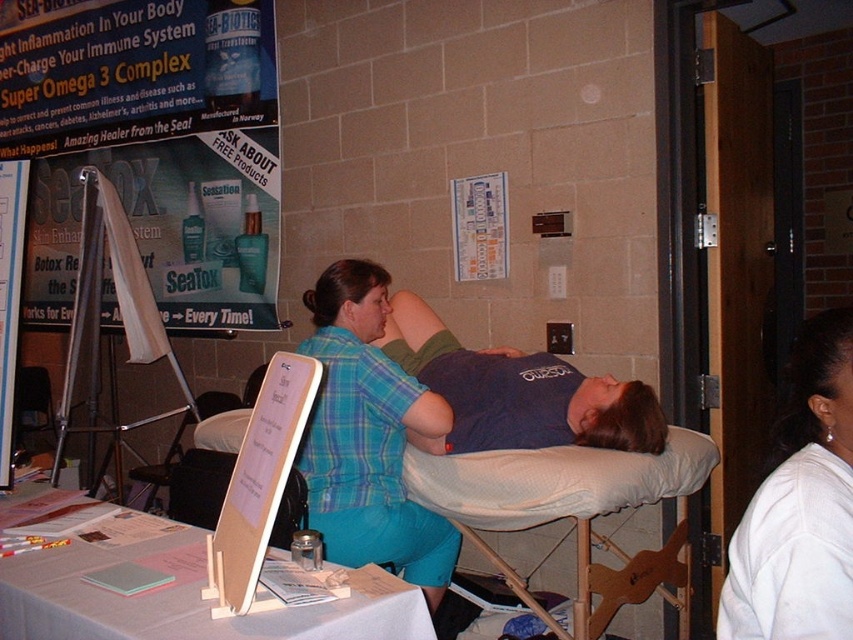
Question: Estimate the real-world distances between objects in this image. Which object is closer to the blue cotton shirt at center?

Choices:
 (A) black plastic chair at lower left
 (B) matte plastic poster at upper left
 (C) white fabric at upper right

Answer: (C)

Question: Is white fabric at upper right smaller than white paper at center?

Choices:
 (A) yes
 (B) no

Answer: (A)

Question: Can you confirm if matte plastic poster at upper left is smaller than white fabric at upper right?

Choices:
 (A) no
 (B) yes

Answer: (A)

Question: Which of the following is the closest to the observer?

Choices:
 (A) matte plastic poster at upper left
 (B) black plastic chair at lower left

Answer: (B)

Question: Based on their relative distances, which object is farther from the black plastic chair at lower left?

Choices:
 (A) white fabric at upper right
 (B) white paper at center
 (C) blue cotton shirt at center

Answer: (A)

Question: Can you confirm if white fabric at upper right is bigger than blue cotton shirt at center?

Choices:
 (A) yes
 (B) no

Answer: (B)